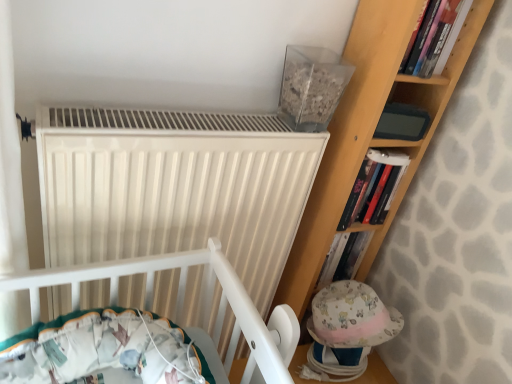
Question: Is hardcover book at upper right, which ranks as the 1th book in back-to-front order, further to camera compared to hardcover book at upper right, positioned as the 1th book in top-to-bottom order?

Choices:
 (A) yes
 (B) no

Answer: (A)

Question: Considering the relative sizes of hardcover book at upper right, the second book from the front, and hardcover book at upper right, positioned as the 1th book in top-to-bottom order, in the image provided, is hardcover book at upper right, the second book from the front, taller than hardcover book at upper right, positioned as the 1th book in top-to-bottom order,?

Choices:
 (A) yes
 (B) no

Answer: (A)

Question: Is hardcover book at upper right, positioned as the second book in top-to-bottom order, looking in the opposite direction of hardcover book at upper right, the 2th book when ordered from back to front?

Choices:
 (A) yes
 (B) no

Answer: (B)

Question: Can you confirm if hardcover book at upper right, the second book from the front, is wider than hardcover book at upper right, positioned as the 1th book in top-to-bottom order?

Choices:
 (A) no
 (B) yes

Answer: (A)

Question: Is hardcover book at upper right, which ranks as the 1th book in back-to-front order, positioned beyond the bounds of hardcover book at upper right, positioned as the second book in bottom-to-top order?

Choices:
 (A) yes
 (B) no

Answer: (A)

Question: From a real-world perspective, relative to hardcover book at upper right, positioned as the second book in top-to-bottom order, is fluffy fabric baby hat at lower right vertically above or below?

Choices:
 (A) above
 (B) below

Answer: (B)

Question: From the image's perspective, is fluffy fabric baby hat at lower right above or below hardcover book at upper right, which ranks as the 1th book in back-to-front order?

Choices:
 (A) above
 (B) below

Answer: (B)

Question: In terms of height, does fluffy fabric baby hat at lower right look taller or shorter compared to hardcover book at upper right, which ranks as the first book in bottom-to-top order?

Choices:
 (A) tall
 (B) short

Answer: (B)

Question: Is fluffy fabric baby hat at lower right inside the boundaries of hardcover book at upper right, the second book from the front, or outside?

Choices:
 (A) inside
 (B) outside

Answer: (B)

Question: Is point (401, 167) positioned closer to the camera than point (273, 150)?

Choices:
 (A) closer
 (B) farther

Answer: (B)

Question: From their relative heights in the image, would you say hardcover book at upper right, positioned as the second book in top-to-bottom order, is taller or shorter than white matte radiator at upper center?

Choices:
 (A) tall
 (B) short

Answer: (B)

Question: Based on their sizes in the image, would you say hardcover book at upper right, which ranks as the 1th book in back-to-front order, is bigger or smaller than white matte radiator at upper center?

Choices:
 (A) big
 (B) small

Answer: (B)

Question: Considering their positions, is hardcover book at upper right, positioned as the second book in top-to-bottom order, located in front of or behind white matte radiator at upper center?

Choices:
 (A) behind
 (B) front

Answer: (A)

Question: Considering their positions, is white matte radiator at upper center located in front of or behind matte gray paperback book at upper right?

Choices:
 (A) front
 (B) behind

Answer: (A)

Question: Based on their sizes in the image, would you say white matte radiator at upper center is bigger or smaller than matte gray paperback book at upper right?

Choices:
 (A) small
 (B) big

Answer: (B)